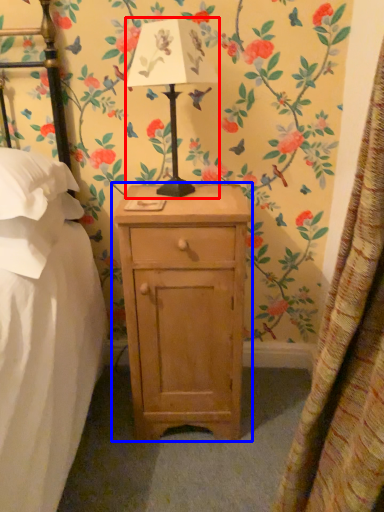
Question: Which object is further to the camera taking this photo, table lamp (highlighted by a red box) or nightstand (highlighted by a blue box)?

Choices:
 (A) table lamp
 (B) nightstand

Answer: (B)